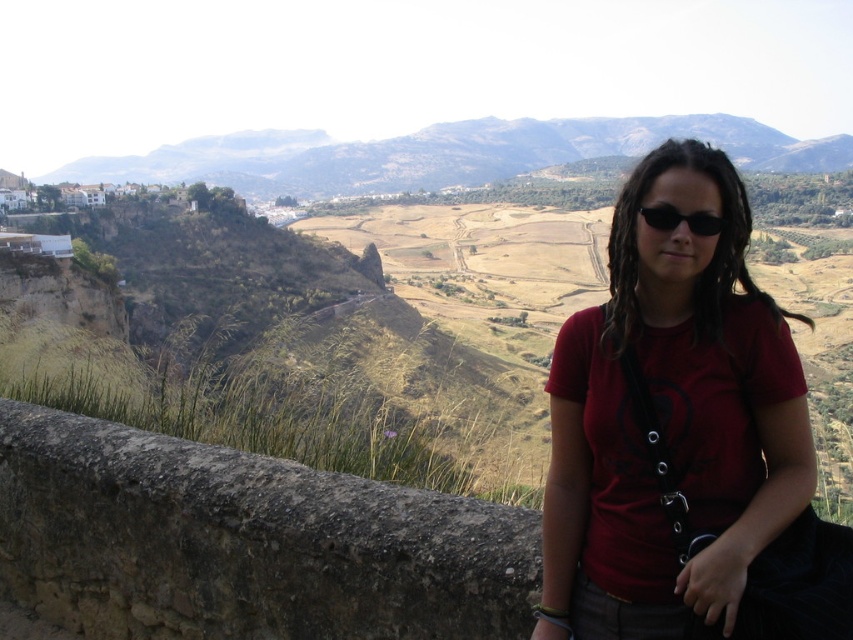
Is matte red t-shirt at center below black matte sunglasses at center?

Indeed, matte red t-shirt at center is positioned under black matte sunglasses at center.

The image size is (853, 640). Find the location of `matte red t-shirt at center`. matte red t-shirt at center is located at coordinates (670, 417).

Locate an element on the screen. matte red t-shirt at center is located at coordinates (670, 417).

Is matte red t-shirt at center shorter than rugged brown mountain at upper center?

Correct, matte red t-shirt at center is not as tall as rugged brown mountain at upper center.

Is matte red t-shirt at center bigger than rugged brown mountain at upper center?

No, matte red t-shirt at center is not bigger than rugged brown mountain at upper center.

Is point (704, 468) farther from viewer compared to point (351, 141)?

No.

Image resolution: width=853 pixels, height=640 pixels. Find the location of `matte red t-shirt at center`. matte red t-shirt at center is located at coordinates (670, 417).

Does rugged brown mountain at upper center come in front of black matte sunglasses at center?

No, it is not.

Can you confirm if rugged brown mountain at upper center is thinner than black matte sunglasses at center?

Incorrect, rugged brown mountain at upper center's width is not less than black matte sunglasses at center's.

Locate an element on the screen. rugged brown mountain at upper center is located at coordinates (447, 154).

Where is `rugged brown mountain at upper center`? rugged brown mountain at upper center is located at coordinates (447, 154).